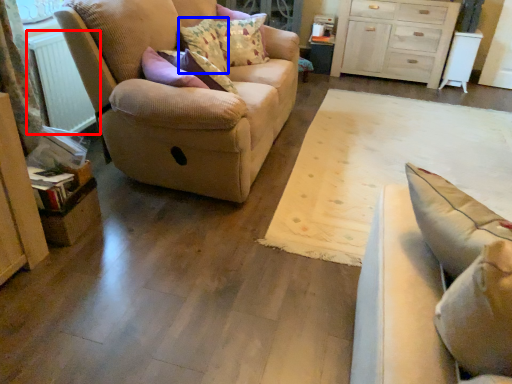
Question: Which point is closer to the camera, radiator (highlighted by a red box) or pillow (highlighted by a blue box)?

Choices:
 (A) radiator
 (B) pillow

Answer: (A)